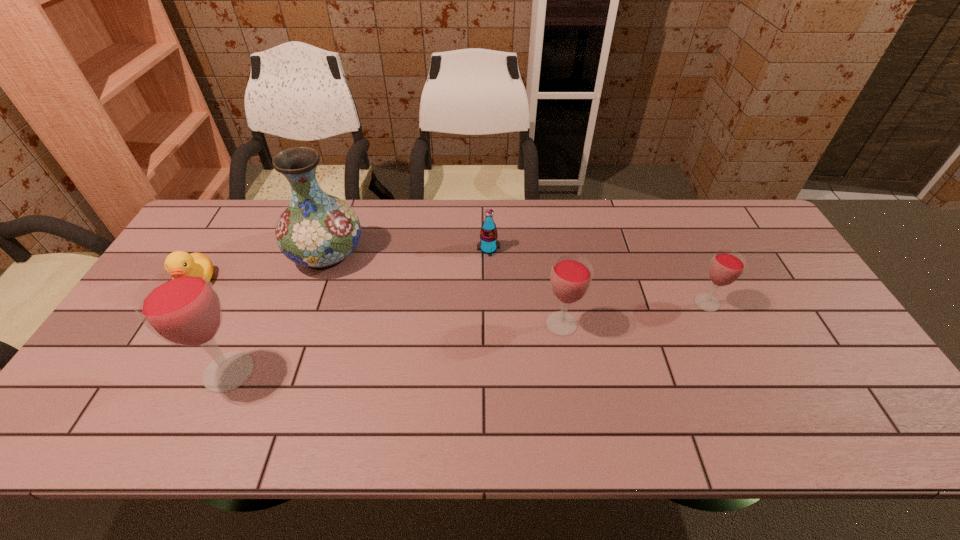
Locate an element on the screen. vacant space located 0.190m on the left of the leftmost wineglass is located at coordinates (x=124, y=372).

The height and width of the screenshot is (540, 960). Identify the location of blank space located on the back of the second wineglass from left to right. (555, 281).

What are the coordinates of `blank area located on the left of the rightmost wineglass` in the screenshot? It's located at (671, 303).

The image size is (960, 540). Identify the location of free spot located 0.240m at the beak of the shortest object. coord(141,375).

You are a GUI agent. You are given a task and a screenshot of the screen. Output one action in this format:
    pyautogui.click(x=<x>, y=<y>)
    Task: Click on the vacant space positioned on the left of the vase
    This screenshot has height=540, width=960.
    Given the screenshot: What is the action you would take?
    pyautogui.click(x=221, y=254)

Where is `vacant point located on the left of the soda`? The height and width of the screenshot is (540, 960). vacant point located on the left of the soda is located at coordinates (442, 249).

Identify the location of vase located in the far edge section of the desktop. Image resolution: width=960 pixels, height=540 pixels. (317, 230).

Identify the location of soda situated at the far edge. (488, 244).

What are the coordinates of `object that is at the near edge` in the screenshot? It's located at (181, 306).

The image size is (960, 540). Identify the location of object located at the left edge. (176, 259).